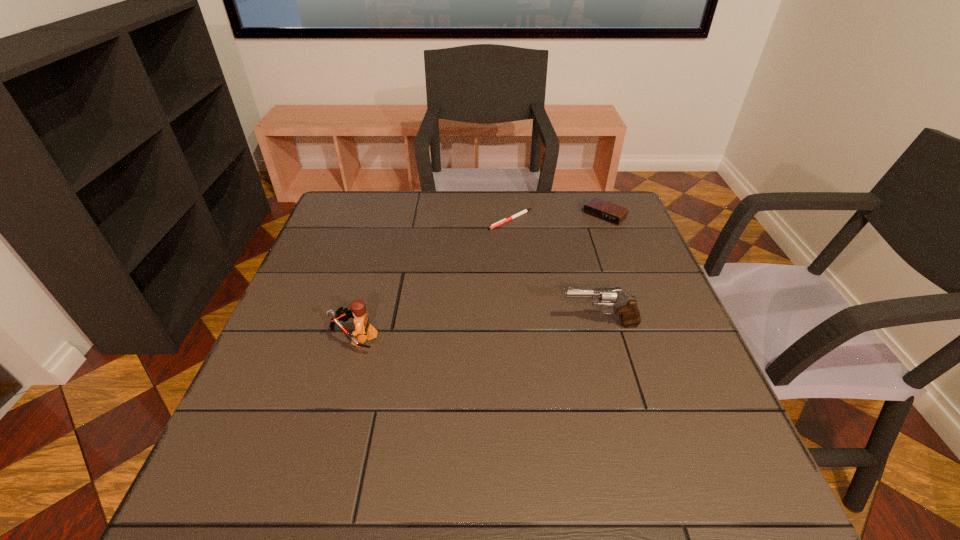
Identify the location of vacant space situated 0.050m on the clicker of the second object from left to right. This screenshot has width=960, height=540. (499, 240).

Locate an element on the screen. The width and height of the screenshot is (960, 540). vacant space situated 0.330m on the clicker of the second object from left to right is located at coordinates (465, 305).

This screenshot has height=540, width=960. I want to click on vacant space located on the front face of the third tallest object, so click(534, 281).

Locate an element on the screen. The image size is (960, 540). vacant area situated on the front face of the third tallest object is located at coordinates (569, 247).

Locate an element on the screen. The image size is (960, 540). vacant space located 0.150m on the front face of the third tallest object is located at coordinates (569, 247).

Where is `pen located in the far edge section of the desktop`? Image resolution: width=960 pixels, height=540 pixels. pen located in the far edge section of the desktop is located at coordinates (505, 220).

This screenshot has height=540, width=960. I want to click on alarm clock that is at the far edge, so click(x=598, y=208).

Where is `object that is positioned at the left edge`? The image size is (960, 540). object that is positioned at the left edge is located at coordinates (363, 328).

Find the location of a particular element. Image resolution: width=960 pixels, height=540 pixels. pistol present at the right edge is located at coordinates (626, 306).

Locate an element on the screen. alarm clock positioned at the right edge is located at coordinates (598, 208).